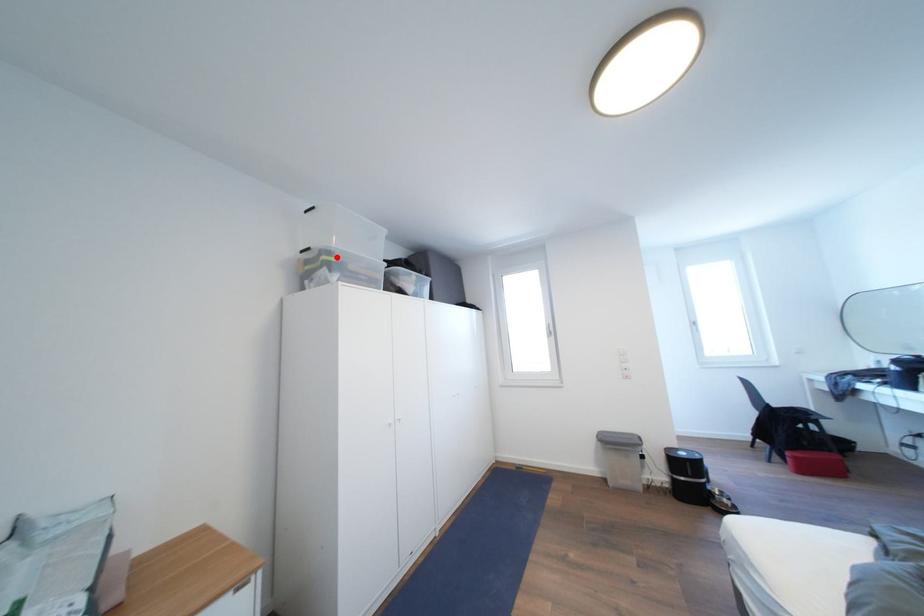
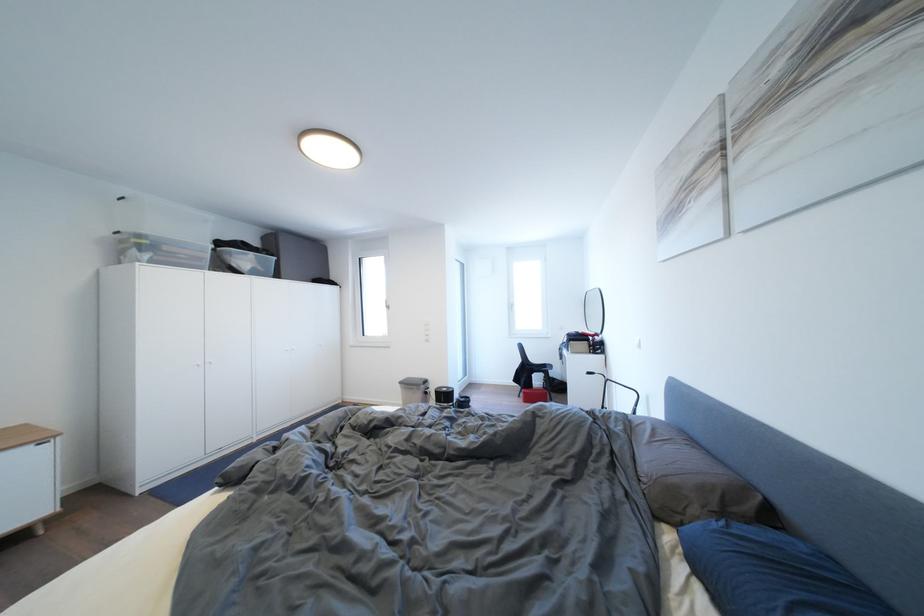
The point at the highlighted location is marked in the first image. Where is the corresponding point in the second image?

(149, 241)